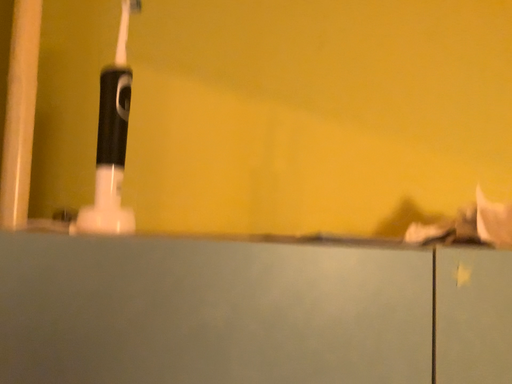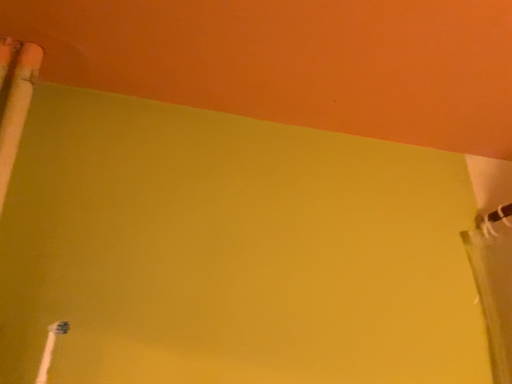
Question: Which way did the camera rotate in the video?

Choices:
 (A) rotated upward
 (B) rotated downward

Answer: (A)